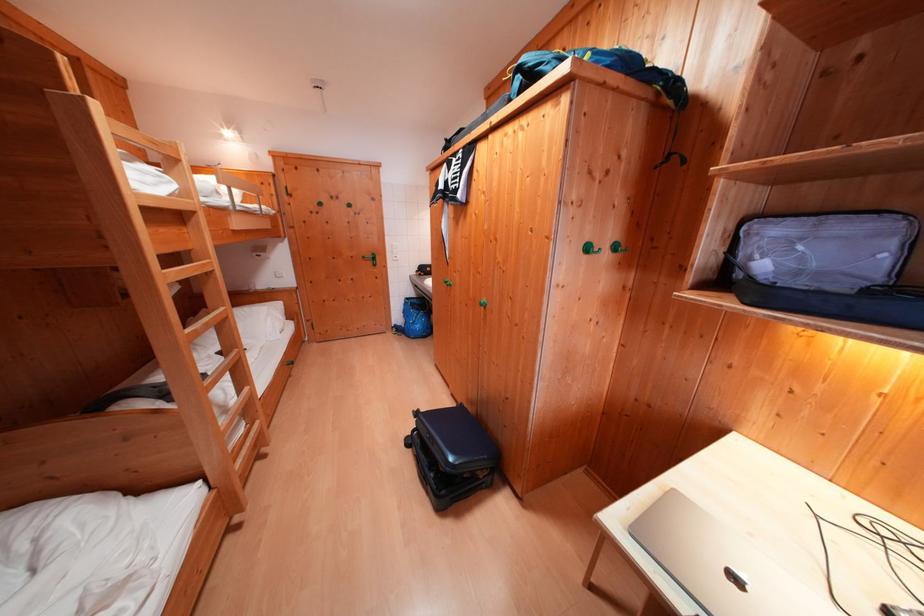
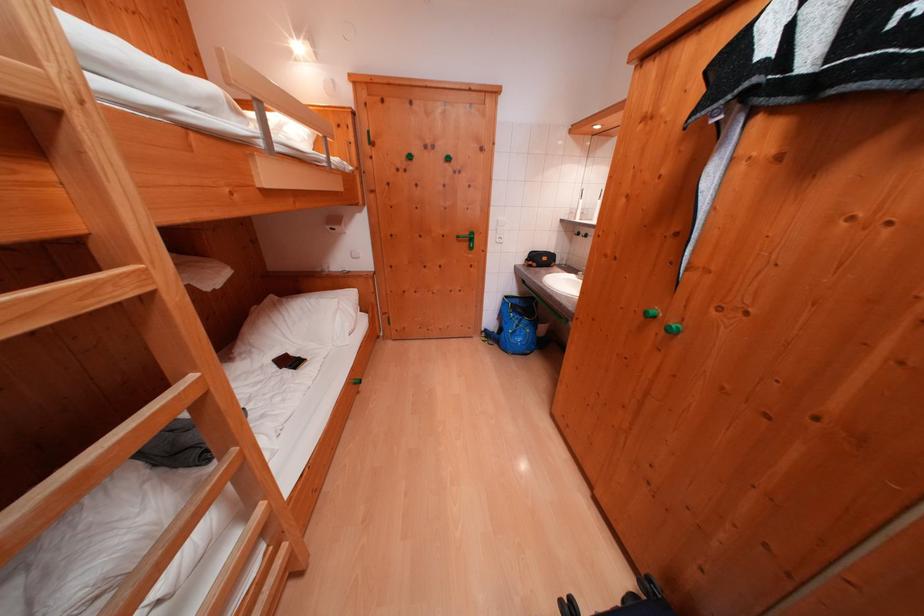
In the second image, find the point that corresponds to point (371, 262) in the first image.

(466, 241)